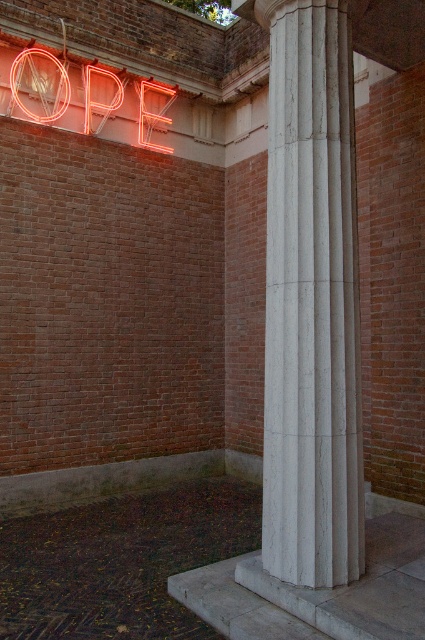
Does white marble column at center appear over neontexturedsign at upper left?

Actually, white marble column at center is below neontexturedsign at upper left.

Measure the distance from white marble column at center to neontexturedsign at upper left.

They are 3.80 meters apart.

Between point (309, 552) and point (150, 116), which one is positioned in front?

Positioned in front is point (309, 552).

Locate an element on the screen. The width and height of the screenshot is (425, 640). white marble column at center is located at coordinates (311, 301).